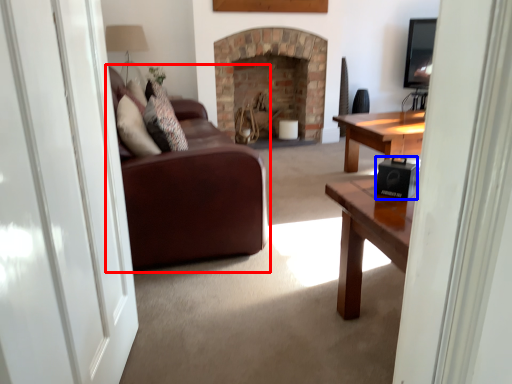
Question: Which object is further to the camera taking this photo, studio couch (highlighted by a red box) or speaker (highlighted by a blue box)?

Choices:
 (A) studio couch
 (B) speaker

Answer: (A)